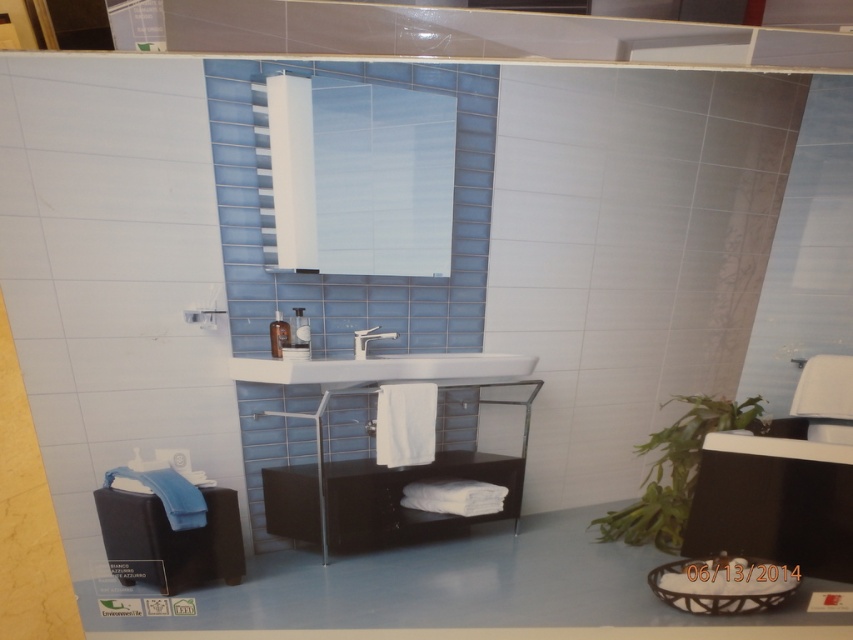
You are a person who is 1.6 meters tall and want to sit on the matte black stool at lower left while using the matte silver faucet at center. Can you comfortably reach the faucet from the stool?

The matte black stool at lower left is taller than the matte silver faucet at center. Since the stool is taller than the faucet, sitting on it would place you higher than the faucet, making it difficult to comfortably reach the faucet.

Consider the image. You are standing in the bathroom and want to place a decorative item between the black glossy vanity at center and the white glossy sink at center. Which side of the sink should you place it on to be between them?

You should place the decorative item to the right of the white glossy sink at center since the black glossy vanity at center is located to its right, placing the item there would position it between them.

In the scene shown: You are a visitor in this bathroom and want to sit down. You see a matte black stool at lower left and a white glossy sink at center. Which object is larger and can you sit on it?

The matte black stool at lower left is bigger than the white glossy sink at center. Since stools are designed for sitting, you can sit on the matte black stool at lower left.